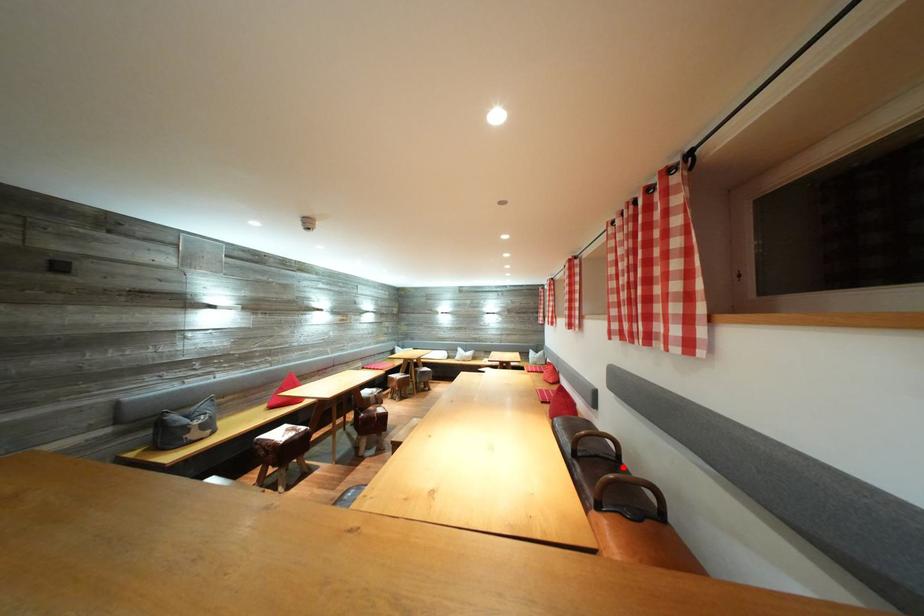
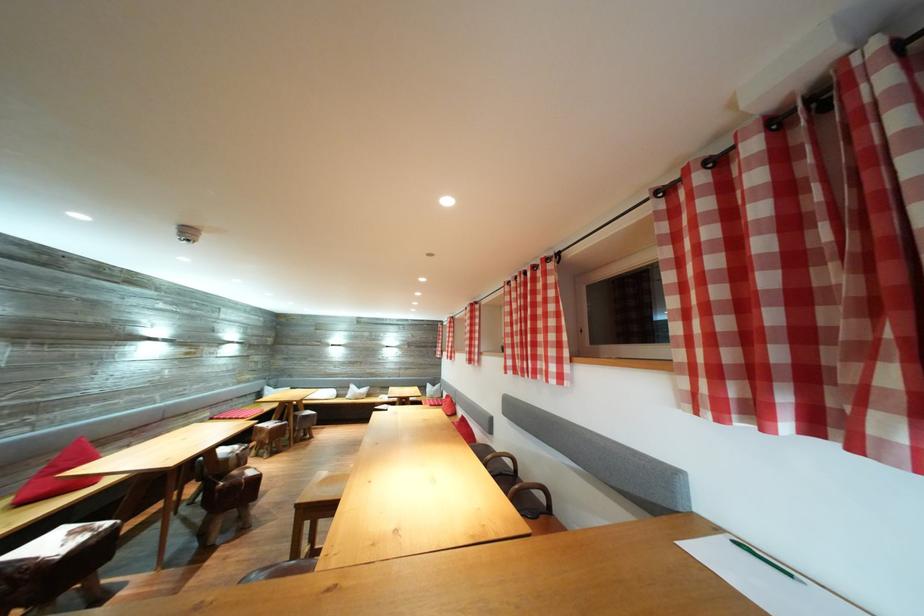
In the second image, find the point that corresponds to the highlighted location in the first image.

(521, 480)